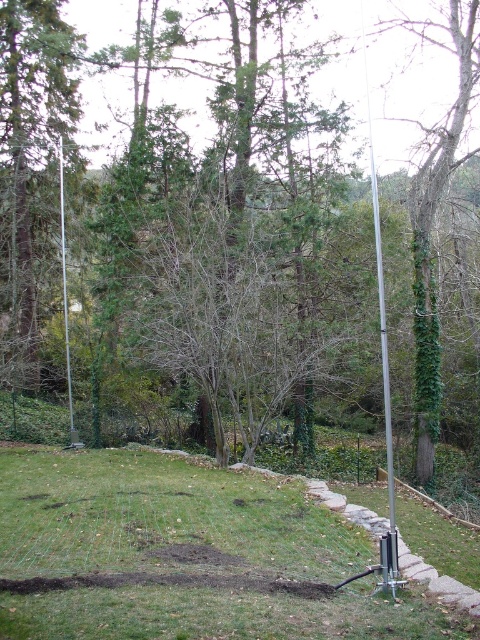
You are standing at the point with coordinates point (x=286, y=600) and want to walk towards the point (x=434, y=157). Given the terrain described in the scene, what might you encounter first along your path?

You might encounter the stone retaining wall in the middle ground first because it is located between the two points along the path.

You are a gardener who needs to plant a new shrub between the green grass at center and the stone retaining wall in the middle ground. The shrub requires a minimum of 5 meters of space to grow properly. Based on the scene, will there be enough space for the shrub to grow?

The distance between the green grass at center and the stone retaining wall in the middle ground is 4.84 meters. Since the shrub requires a minimum of 5 meters of space, there is insufficient space for it to grow properly.

You are a gardener planning to install a new sprinkler system. You notice the green grass at center and the silver metallic pole at center. Which object is smaller in size?

The green grass at center is smaller in size compared to the silver metallic pole at center.